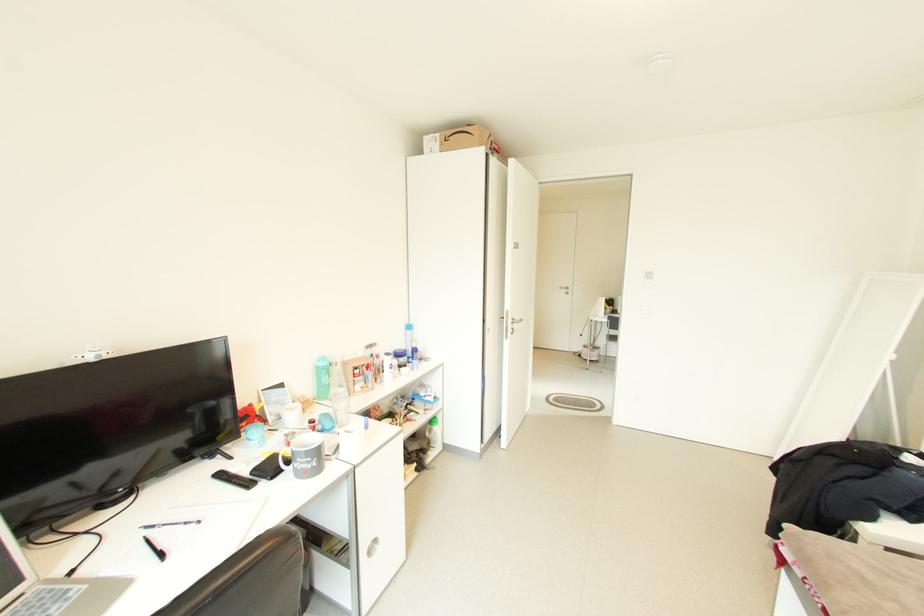
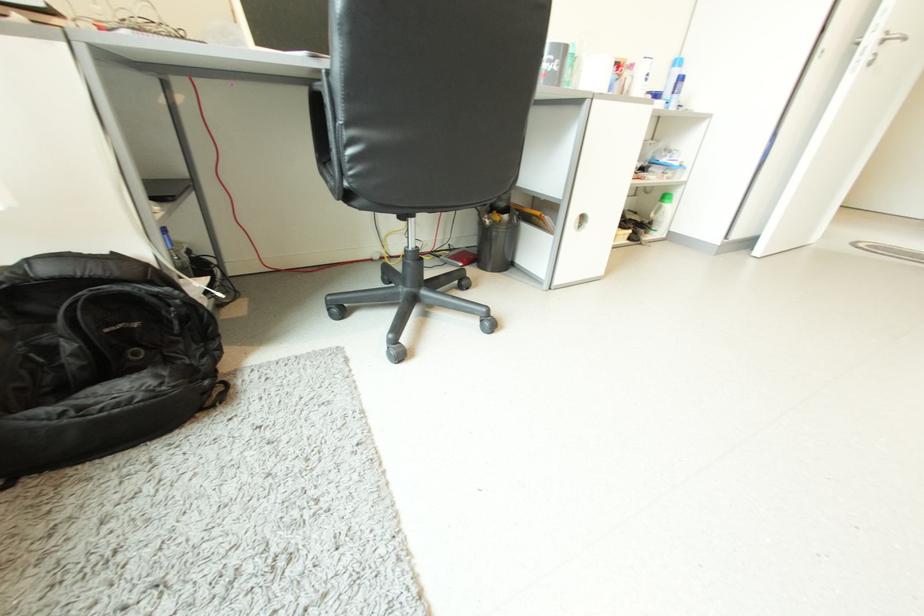
The point at (x=415, y=328) is marked in the first image. Where is the corresponding point in the second image?

(681, 63)